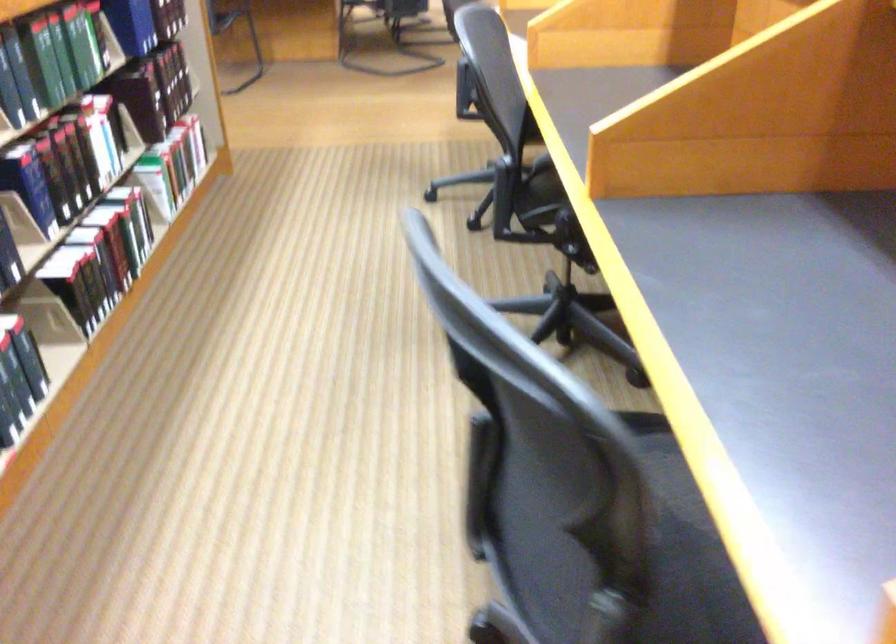
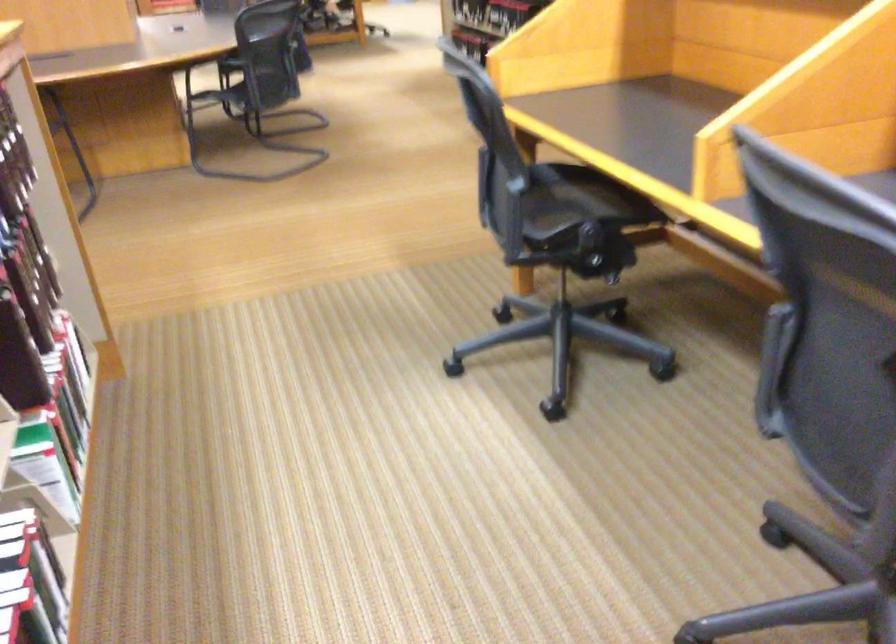
Where in the second image is the point corresponding to pixel 150 176 from the first image?

(37, 466)